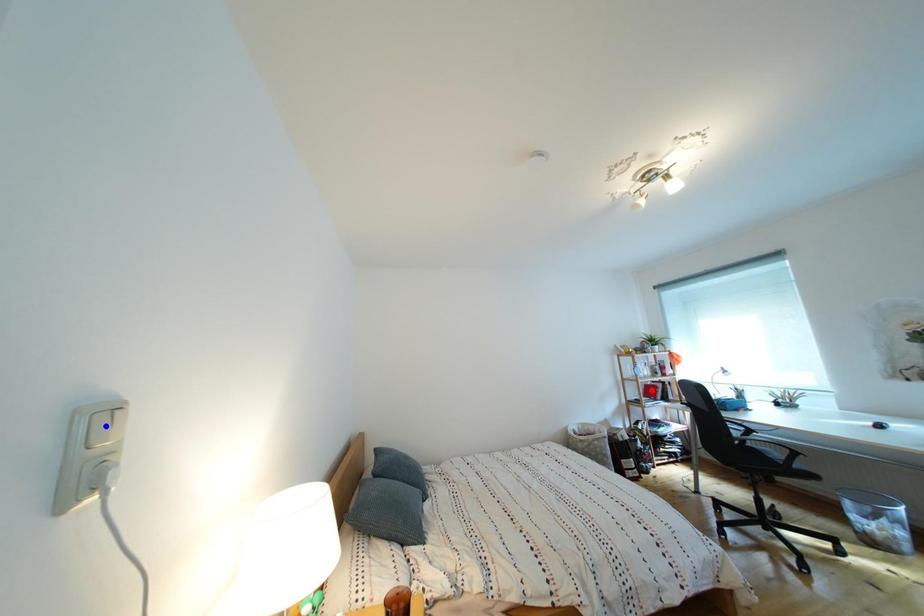
Question: Which of the two points in the image is closer to the camera?

Choices:
 (A) Blue point is closer.
 (B) Red point is closer.

Answer: (A)